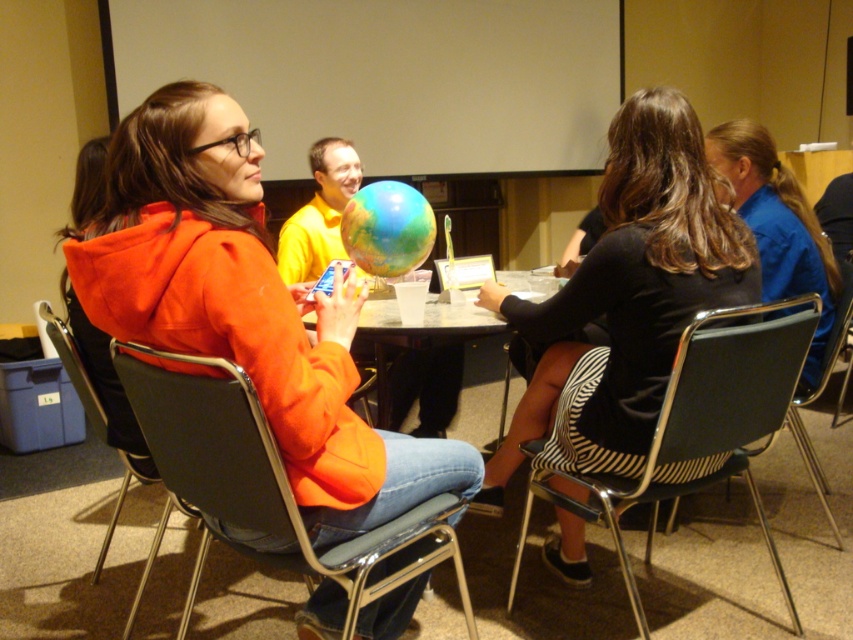
Question: Among these points, which one is nearest to the camera?

Choices:
 (A) (815, 355)
 (B) (849, 289)
 (C) (247, 513)

Answer: (C)

Question: Is metallic gray chair at center further to camera compared to metallic gray chair at left?

Choices:
 (A) no
 (B) yes

Answer: (A)

Question: Which point is farther from the camera taking this photo?

Choices:
 (A) (624, 557)
 (B) (90, 378)
 (C) (268, 524)
 (D) (804, 424)

Answer: (D)

Question: Can you confirm if metallic gray chair at center is positioned to the right of blue fabric shirt at right?

Choices:
 (A) yes
 (B) no

Answer: (B)

Question: Observing the image, what is the correct spatial positioning of black matte dress at center in reference to black fabric chair at center?

Choices:
 (A) above
 (B) below

Answer: (A)

Question: Considering the real-world distances, which object is farthest from the black matte dress at center?

Choices:
 (A) black fabric chair at center
 (B) metallic gray chair at left
 (C) orange matte jacket at center
 (D) black plastic chair at center

Answer: (B)